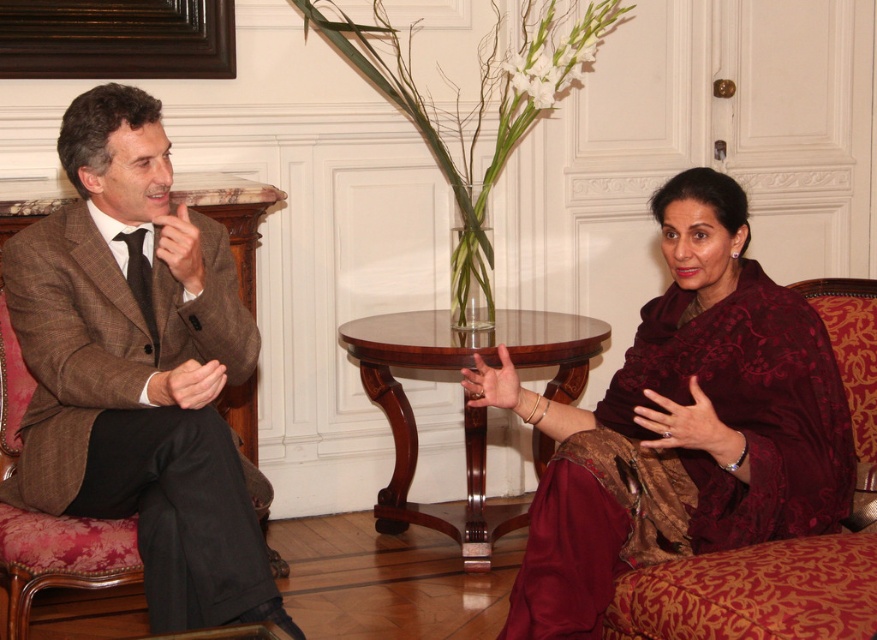
You are planning to place a rectangular document on the mahogany wood round table at center during a meeting. The document is as wide as the matte brown suit at left. Will the document fit entirely on the table?

The mahogany wood round table at center is wider than the matte brown suit at left, so the document, which is as wide as the matte brown suit at left, will fit entirely on the table.

You are an interior designer assessing the spatial arrangement of the room. The brown textured suit at left and the matte brown hand at center are both in the foreground. Which object occupies more horizontal space in the image?

The brown textured suit at left is wider than the matte brown hand at center, so it occupies more horizontal space in the image.

You are a photographer positioned at the entrance of the room. You want to take a photo of the matte brown suit at left and the mahogany wood round table at center without any obstructions. Based on their positions, which object should you move closer to ensure both are clearly visible in the frame?

The matte brown suit at left is behind the mahogany wood round table at center. To ensure both are clearly visible without obstruction, move closer to the mahogany wood round table at center so that the matte brown suit at left is visible behind it.